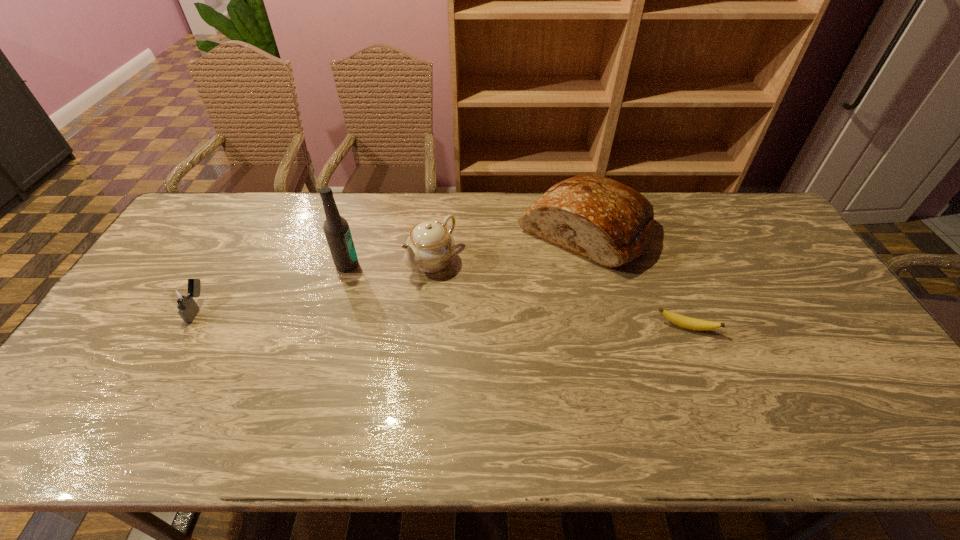
Identify the location of the leftmost object. (183, 300).

Find the location of a particular element. the fourth tallest object is located at coordinates (183, 300).

You are a GUI agent. You are given a task and a screenshot of the screen. Output one action in this format:
    pyautogui.click(x=<x>, y=<y>)
    Task: Click on the shortest object
    
    Given the screenshot: What is the action you would take?
    pyautogui.click(x=683, y=321)

You are a GUI agent. You are given a task and a screenshot of the screen. Output one action in this format:
    pyautogui.click(x=<x>, y=<y>)
    Task: Click on the second tallest object
    
    Given the screenshot: What is the action you would take?
    pyautogui.click(x=610, y=223)

The width and height of the screenshot is (960, 540). I want to click on chinaware, so click(429, 247).

You are a GUI agent. You are given a task and a screenshot of the screen. Output one action in this format:
    pyautogui.click(x=<x>, y=<y>)
    Task: Click on the third object from right to left
    This screenshot has height=540, width=960.
    Given the screenshot: What is the action you would take?
    pyautogui.click(x=429, y=247)

Identify the location of the fourth object from right to left. This screenshot has height=540, width=960. [x=336, y=228].

The height and width of the screenshot is (540, 960). Find the location of `beer bottle`. beer bottle is located at coordinates (336, 228).

Find the location of a particular element. vacant position located 0.400m on the right of the second shortest object is located at coordinates (350, 308).

Where is `vacant area situated 0.250m on the back of the banana`? vacant area situated 0.250m on the back of the banana is located at coordinates (658, 256).